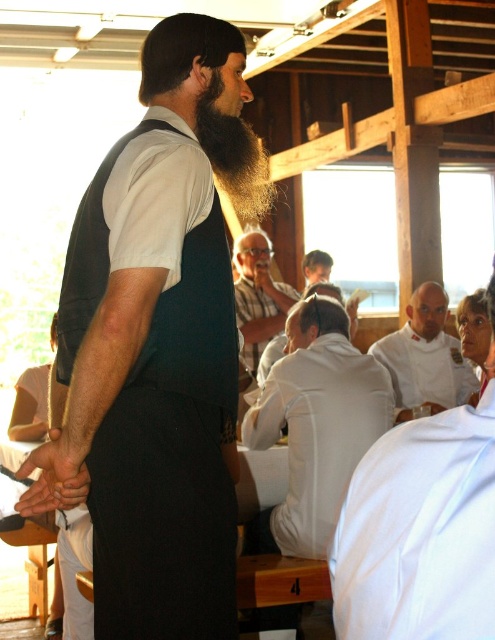
Question: Which is nearer to the white matte shirt at center?

Choices:
 (A) white smooth shirt at upper right
 (B) smooth brown hair at center
 (C) dark blue vest at center

Answer: (C)

Question: Among these points, which one is farthest from the camera?

Choices:
 (A) [x=443, y=316]
 (B) [x=289, y=625]
 (C) [x=229, y=173]
 (D) [x=306, y=284]

Answer: (D)

Question: Which point is farther to the camera?

Choices:
 (A) white smooth shirt at upper right
 (B) smooth brown hair at center
 (C) white matte shirt at center

Answer: (B)

Question: Does white chef coat at center have a smaller size compared to striped cotton shirt at center?

Choices:
 (A) yes
 (B) no

Answer: (B)

Question: Is dark blue vest at center below brown fuzzy beard at center?

Choices:
 (A) yes
 (B) no

Answer: (A)

Question: Can you confirm if dark blue vest at center is wider than white chef coat at center?

Choices:
 (A) yes
 (B) no

Answer: (A)